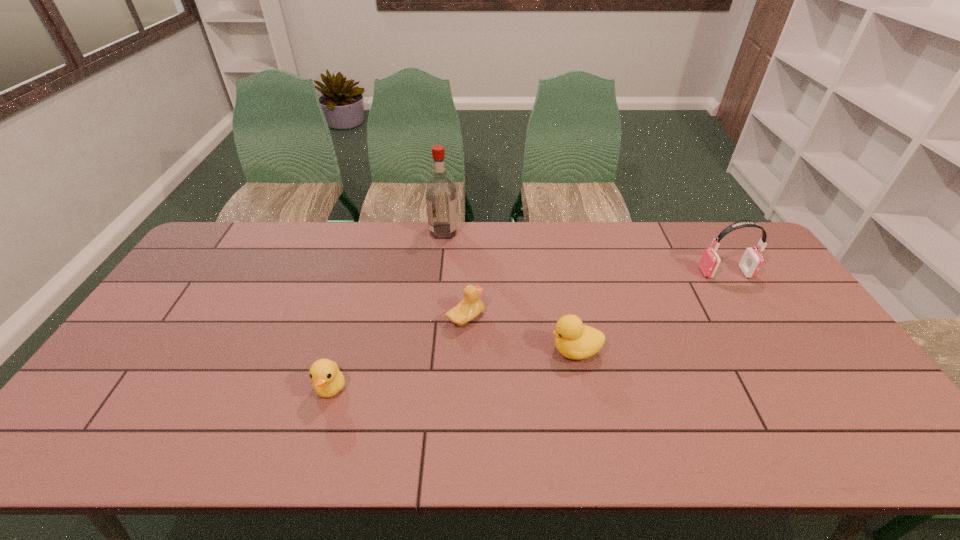
Locate an element on the screen. Image resolution: width=960 pixels, height=540 pixels. blank area in the image that satisfies the following two spatial constraints: 1. at the beak of the second duck from right to left; 2. on the face of the nearest duck is located at coordinates [x=464, y=387].

You are a GUI agent. You are given a task and a screenshot of the screen. Output one action in this format:
    pyautogui.click(x=<x>, y=<y>)
    Task: Click on the vacant area that satisfies the following two spatial constraints: 1. at the beak of the farthest duck; 2. on the face of the leftmost duck
    
    Given the screenshot: What is the action you would take?
    pos(464,387)

Locate an element on the screen. free location that satisfies the following two spatial constraints: 1. at the beak of the third farthest object; 2. on the face of the nearest duck is located at coordinates (464, 387).

You are a GUI agent. You are given a task and a screenshot of the screen. Output one action in this format:
    pyautogui.click(x=<x>, y=<y>)
    Task: Click on the free point that satisfies the following two spatial constraints: 1. on the front-facing side of the tallest object; 2. on the face of the nearest duck
    
    Given the screenshot: What is the action you would take?
    pyautogui.click(x=427, y=387)

I want to click on vacant space that satisfies the following two spatial constraints: 1. on the outer surface of the earphone; 2. on the face of the nearest duck, so click(797, 387).